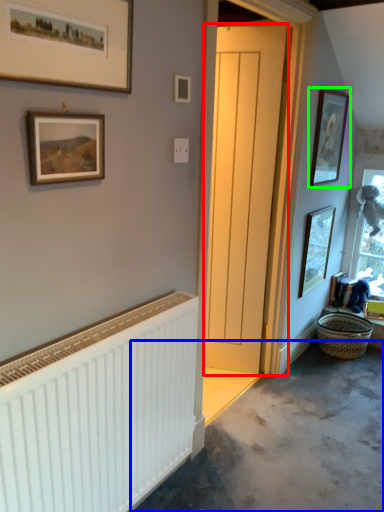
Question: Based on their relative distances, which object is nearer to door (highlighted by a red box)? Choose from concrete (highlighted by a blue box) and picture frame (highlighted by a green box).

Choices:
 (A) concrete
 (B) picture frame

Answer: (B)